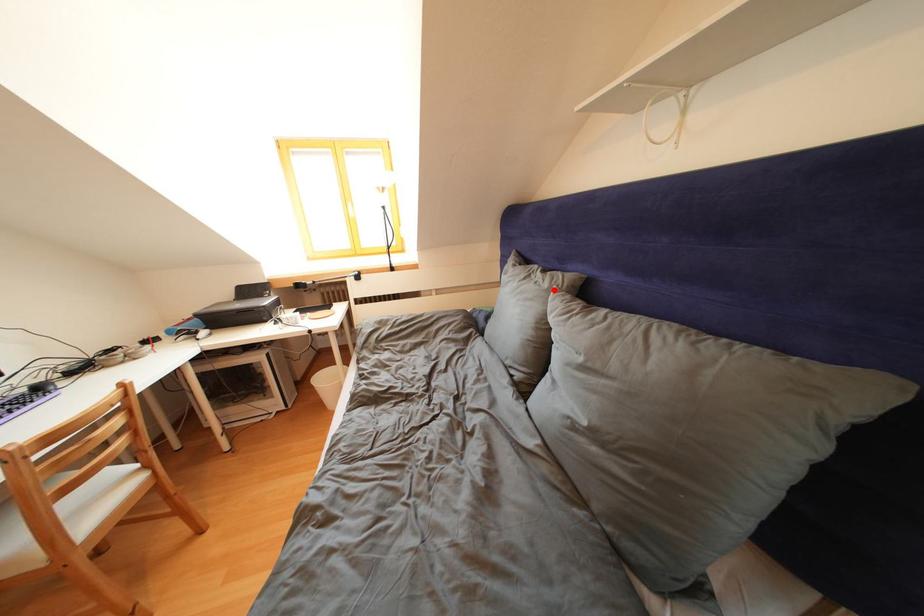
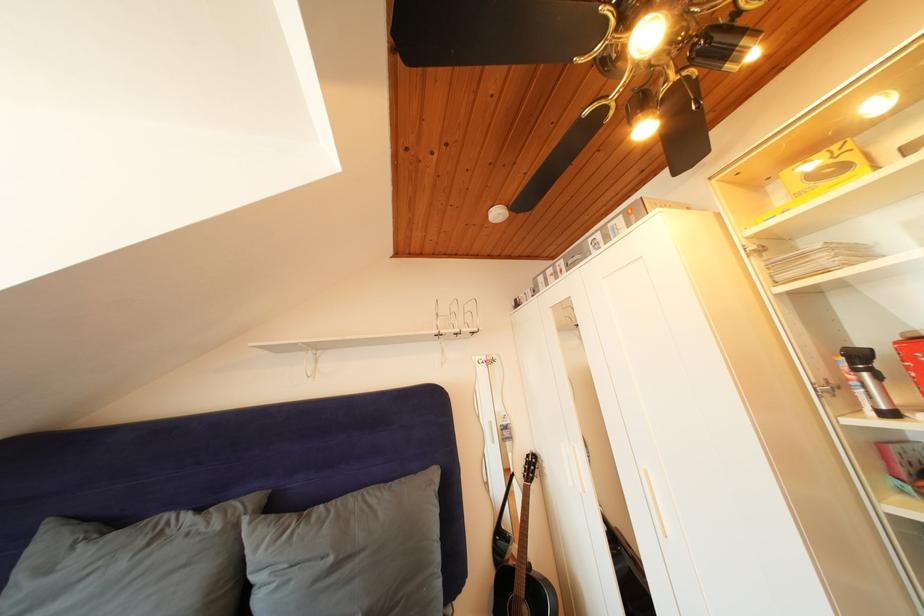
The point at the highlighted location is marked in the first image. Where is the corresponding point in the second image?

(225, 531)